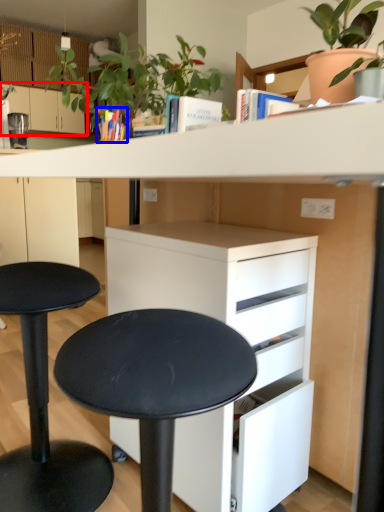
Question: Which object is further to the camera taking this photo, cabinetry (highlighted by a red box) or book (highlighted by a blue box)?

Choices:
 (A) cabinetry
 (B) book

Answer: (A)